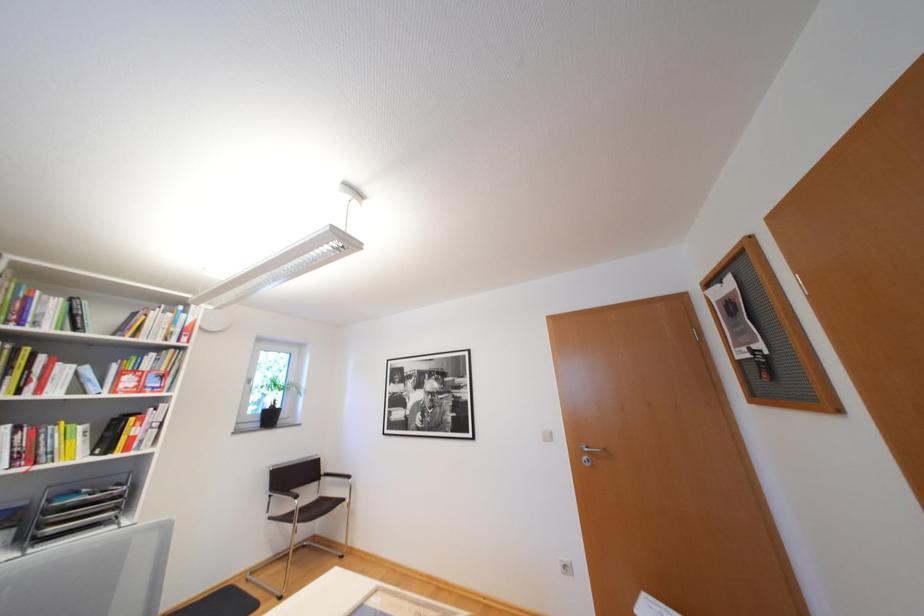
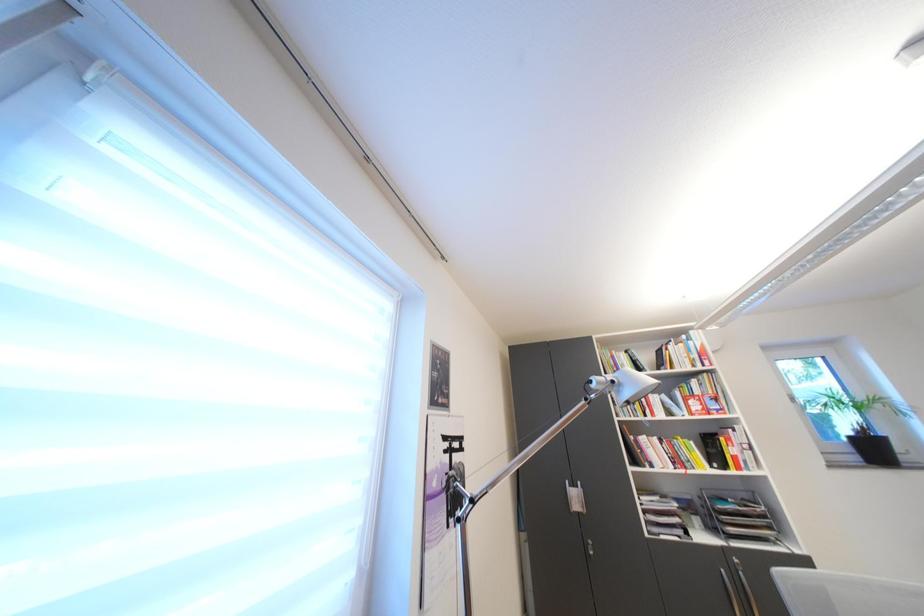
Based on the continuous images, in which direction is the camera rotating?

The camera's rotation is toward left-up.